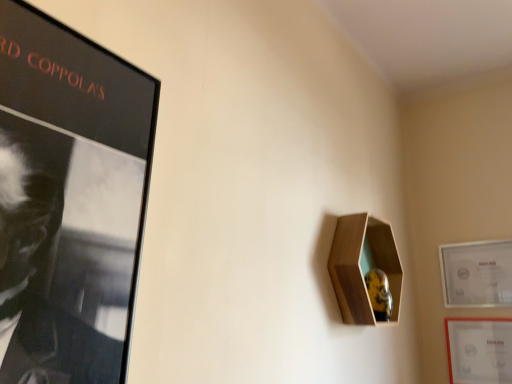
Question: Does matte white picture frame at lower right, which is the 2th picture frame in top-to-bottom order, have a larger size compared to matte white picture frame at right, placed as the first picture frame when sorted from top to bottom?

Choices:
 (A) yes
 (B) no

Answer: (B)

Question: From the image's perspective, is matte white picture frame at lower right, which ranks as the first picture frame in bottom-to-top order, on top of matte white picture frame at right, positioned as the 2th picture frame in bottom-to-top order?

Choices:
 (A) no
 (B) yes

Answer: (A)

Question: Could you tell me if matte white picture frame at lower right, which ranks as the first picture frame in bottom-to-top order, is turned towards matte white picture frame at right, placed as the first picture frame when sorted from top to bottom?

Choices:
 (A) no
 (B) yes

Answer: (A)

Question: Is matte white picture frame at lower right, which ranks as the first picture frame in bottom-to-top order, positioned with its back to matte white picture frame at right, positioned as the 2th picture frame in bottom-to-top order?

Choices:
 (A) yes
 (B) no

Answer: (B)

Question: From a real-world perspective, is matte white picture frame at lower right, which is the 2th picture frame in top-to-bottom order, under matte white picture frame at right, placed as the first picture frame when sorted from top to bottom?

Choices:
 (A) yes
 (B) no

Answer: (A)

Question: From a real-world perspective, is matte white picture frame at right, positioned as the 2th picture frame in bottom-to-top order, physically located above or below matte white picture frame at lower right, which ranks as the first picture frame in bottom-to-top order?

Choices:
 (A) above
 (B) below

Answer: (A)

Question: Is matte white picture frame at right, positioned as the 2th picture frame in bottom-to-top order, inside the boundaries of matte white picture frame at lower right, which is the 2th picture frame in top-to-bottom order, or outside?

Choices:
 (A) outside
 (B) inside

Answer: (A)

Question: In terms of size, does matte white picture frame at right, placed as the first picture frame when sorted from top to bottom, appear bigger or smaller than matte white picture frame at lower right, which ranks as the first picture frame in bottom-to-top order?

Choices:
 (A) small
 (B) big

Answer: (B)

Question: In terms of height, does matte white picture frame at right, positioned as the 2th picture frame in bottom-to-top order, look taller or shorter compared to matte white picture frame at lower right, which is the 2th picture frame in top-to-bottom order?

Choices:
 (A) tall
 (B) short

Answer: (A)

Question: Considering their positions, is wooden hexagonal shelf at upper right located in front of or behind matte white picture frame at right, positioned as the 2th picture frame in bottom-to-top order?

Choices:
 (A) front
 (B) behind

Answer: (A)

Question: In terms of height, does wooden hexagonal shelf at upper right look taller or shorter compared to matte white picture frame at right, placed as the first picture frame when sorted from top to bottom?

Choices:
 (A) tall
 (B) short

Answer: (A)

Question: Considering the positions of point (378, 251) and point (455, 294), is point (378, 251) closer or farther from the camera than point (455, 294)?

Choices:
 (A) farther
 (B) closer

Answer: (B)

Question: Which is correct: wooden hexagonal shelf at upper right is inside matte white picture frame at right, positioned as the 2th picture frame in bottom-to-top order, or outside of it?

Choices:
 (A) inside
 (B) outside

Answer: (B)

Question: Is matte white picture frame at right, placed as the first picture frame when sorted from top to bottom, situated inside wooden hexagonal shelf at upper right or outside?

Choices:
 (A) outside
 (B) inside

Answer: (A)

Question: From the image's perspective, relative to wooden hexagonal shelf at upper right, is matte white picture frame at right, positioned as the 2th picture frame in bottom-to-top order, above or below?

Choices:
 (A) below
 (B) above

Answer: (A)